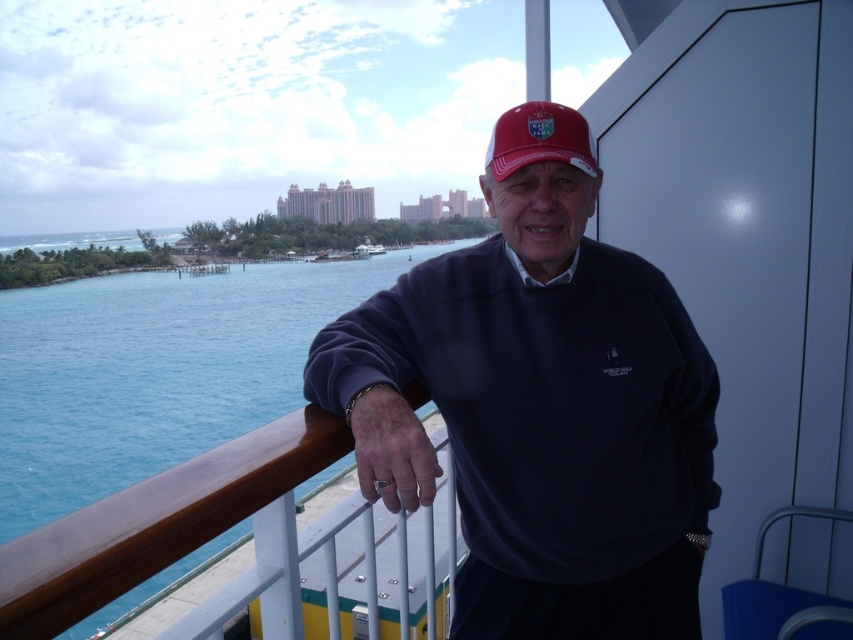
Question: Can you confirm if blue water at left is bigger than matte red cap at center?

Choices:
 (A) yes
 (B) no

Answer: (A)

Question: Can you confirm if blue water at left is positioned below matte red cap at center?

Choices:
 (A) no
 (B) yes

Answer: (A)

Question: Which object is the closest to the blue water at left?

Choices:
 (A) matte navy blue sweater at center
 (B) matte red cap at center

Answer: (A)

Question: Which of the following is the farthest from the observer?

Choices:
 (A) matte navy blue sweater at center
 (B) blue water at left

Answer: (A)

Question: Which of these objects is positioned farthest from the matte navy blue sweater at center?

Choices:
 (A) blue water at left
 (B) matte red cap at center

Answer: (A)

Question: Is matte navy blue sweater at center positioned before matte red cap at center?

Choices:
 (A) no
 (B) yes

Answer: (B)